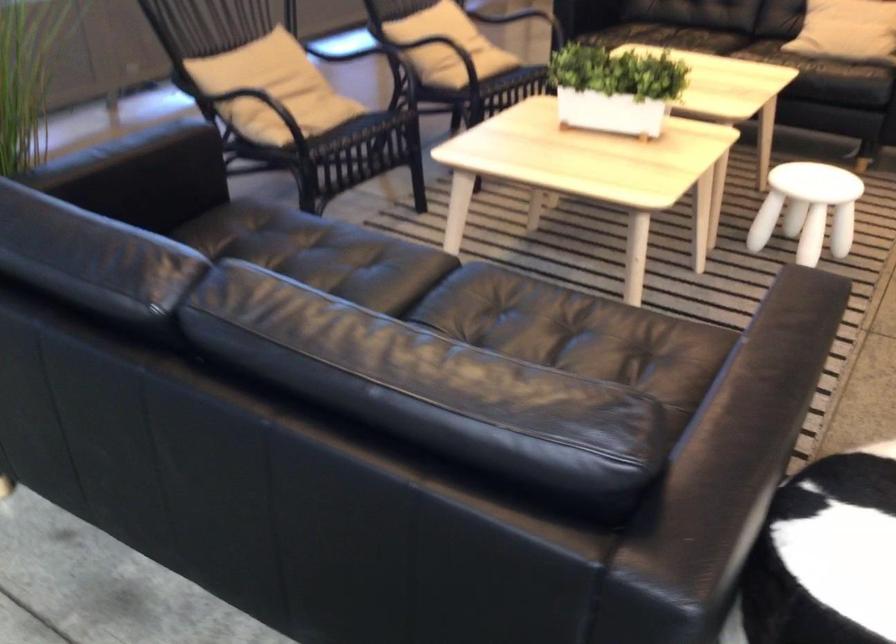
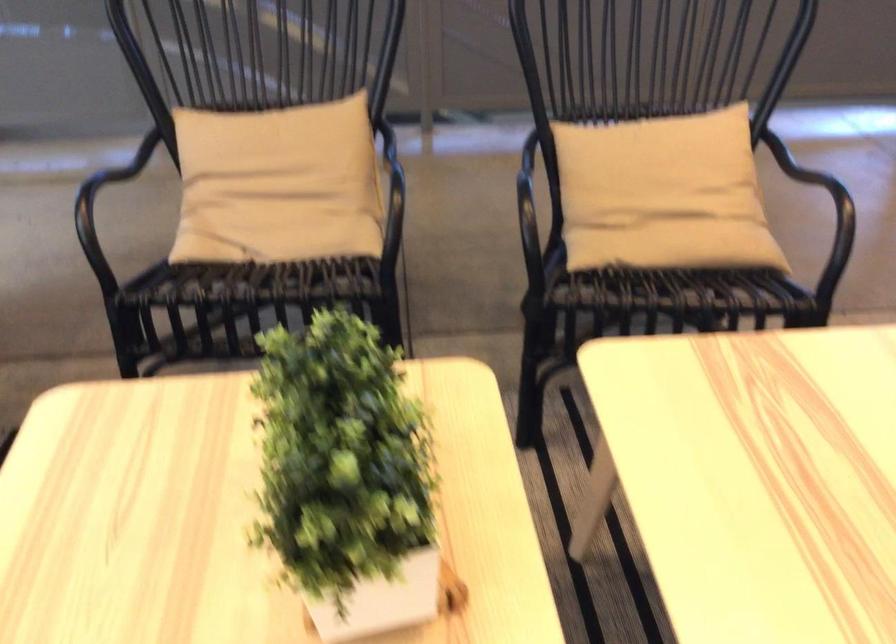
Where in the second image is the point corresponding to point 279,91 from the first image?

(278, 184)